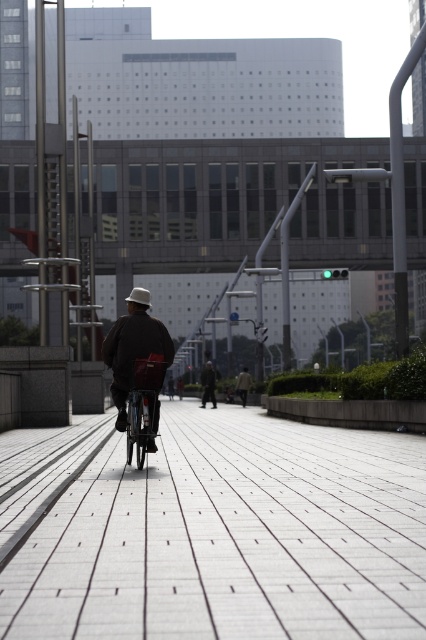
Question: Is gray concrete pavement at center to the left of light brown leather jacket at center from the viewer's perspective?

Choices:
 (A) no
 (B) yes

Answer: (B)

Question: Considering the real-world distances, which object is farthest from the gray concrete pavement at center?

Choices:
 (A) dark gray fabric jacket at center
 (B) light brown leather jacket at center
 (C) shiny metallic bicycle at center
 (D) dark brown leather jacket at center

Answer: (B)

Question: Estimate the real-world distances between objects in this image. Which object is closer to the dark brown leather jacket at center?

Choices:
 (A) shiny metallic bicycle at center
 (B) dark gray fabric jacket at center
 (C) gray concrete pavement at center

Answer: (A)

Question: Can you confirm if dark brown leather jacket at center is bigger than dark gray fabric jacket at center?

Choices:
 (A) yes
 (B) no

Answer: (B)

Question: Can you confirm if gray concrete pavement at center is bigger than light brown leather jacket at center?

Choices:
 (A) no
 (B) yes

Answer: (B)

Question: Which point appears farthest from the camera in this image?

Choices:
 (A) (212, 385)
 (B) (147, 300)

Answer: (A)